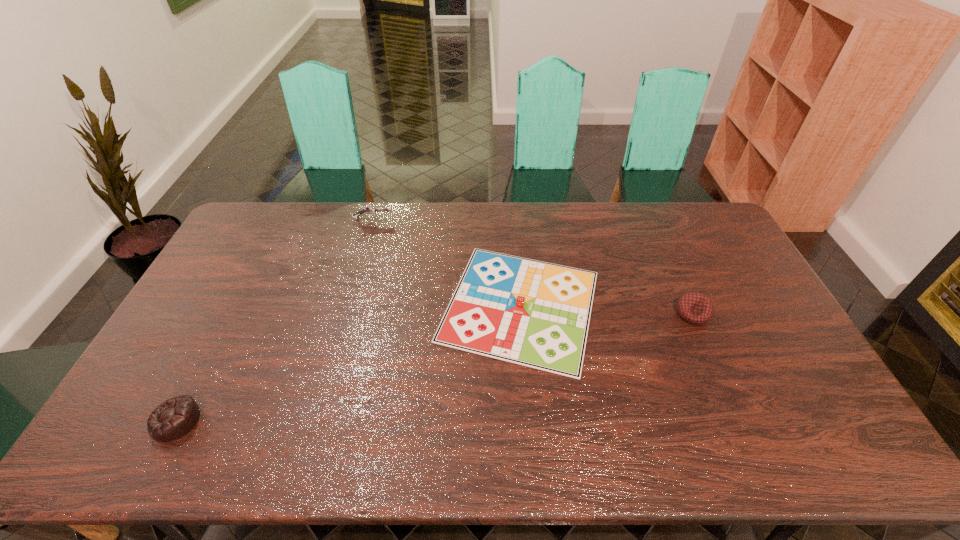
I want to click on the third object from right to left, so click(x=369, y=209).

You are a GUI agent. You are given a task and a screenshot of the screen. Output one action in this format:
    pyautogui.click(x=<x>, y=<y>)
    Task: Click on the gun
    The height and width of the screenshot is (540, 960).
    Given the screenshot: What is the action you would take?
    pyautogui.click(x=369, y=209)

What are the coordinates of `the rightmost object` in the screenshot? It's located at (696, 308).

The width and height of the screenshot is (960, 540). I want to click on the right beanbag, so click(x=696, y=308).

Locate an element on the screen. The width and height of the screenshot is (960, 540). the left beanbag is located at coordinates (174, 418).

Where is `the nearest object`? The height and width of the screenshot is (540, 960). the nearest object is located at coordinates pos(174,418).

Where is `gameboard`? gameboard is located at coordinates (532, 313).

I want to click on the shortest object, so click(x=532, y=313).

Where is `vacant space located 0.250m aimed along the barrel of the gun`? This screenshot has height=540, width=960. vacant space located 0.250m aimed along the barrel of the gun is located at coordinates (458, 219).

Locate an element on the screen. Image resolution: width=960 pixels, height=540 pixels. free space located 0.190m on the left of the farther beanbag is located at coordinates (614, 313).